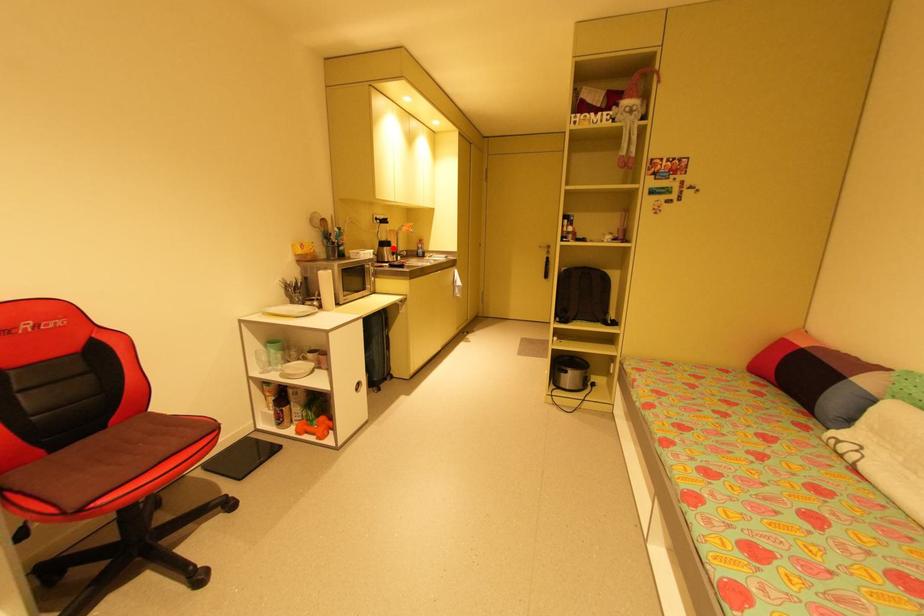
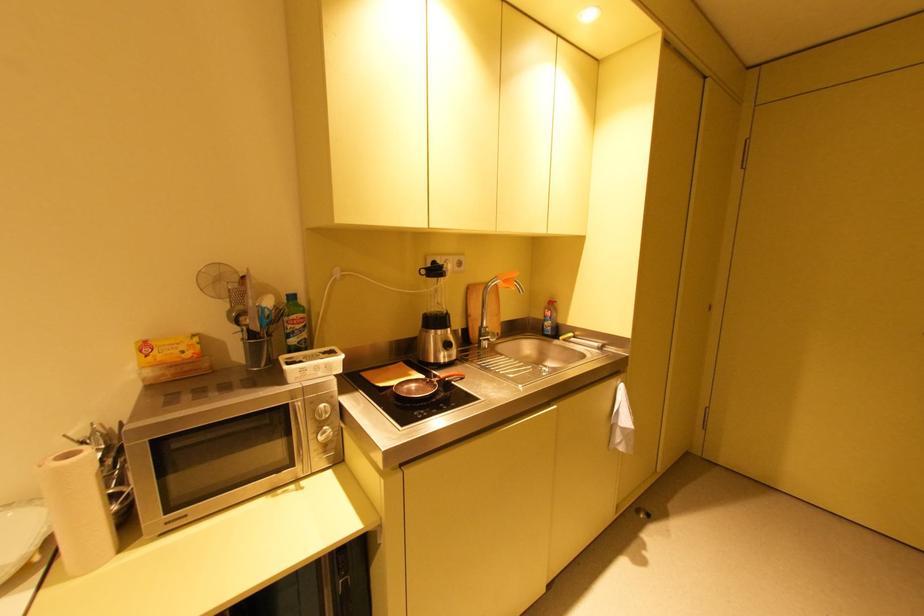
Question: I am providing you with two images of the same scene from different viewpoints. Given a red point in image1, look at the same physical point in image2. Is it:

Choices:
 (A) Closer to the viewpoint
 (B) Farther from the viewpoint

Answer: (B)